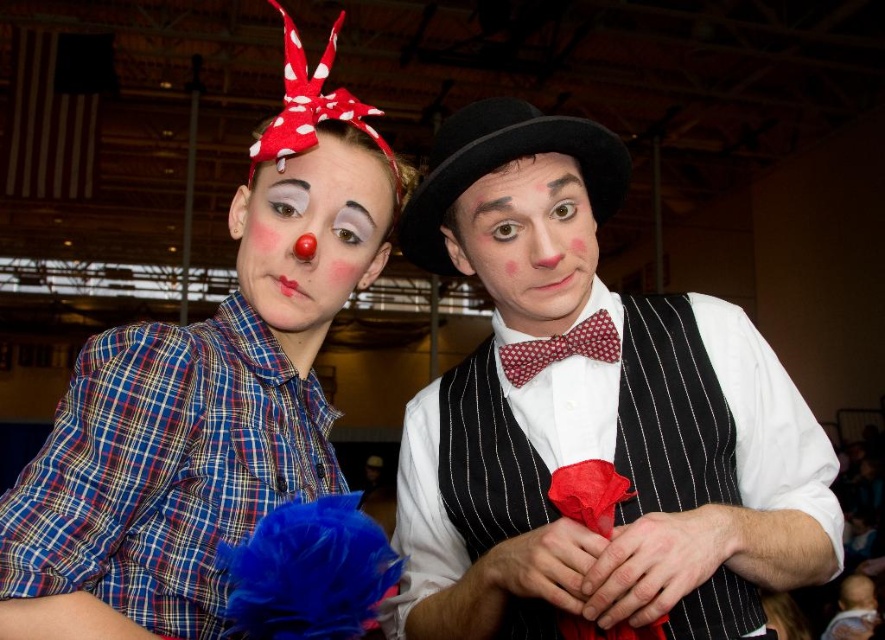
Does point (556, 170) lie in front of point (522, 365)?

Yes, point (556, 170) is in front of point (522, 365).

Is matte red bow tie at center taller than red dotted bow tie at center?

Yes.

Where is `matte red bow tie at center`? matte red bow tie at center is located at coordinates (527, 241).

Which of these two, matte clown nose at center or matte red bow tie at center, stands shorter?

matte red bow tie at center is shorter.

Is point (364, 252) positioned after point (519, 209)?

Yes, it is behind point (519, 209).

Which is behind, point (321, 300) or point (522, 273)?

Positioned behind is point (321, 300).

The width and height of the screenshot is (885, 640). I want to click on matte clown nose at center, so point(312,232).

Is matte black vest at center closer to camera compared to matte clown nose at center?

That is True.

Who is higher up, matte black vest at center or matte clown nose at center?

Positioned higher is matte clown nose at center.

Between point (736, 369) and point (356, 280), which one is positioned in front?

Positioned in front is point (736, 369).

The image size is (885, 640). I want to click on matte black vest at center, so click(x=591, y=419).